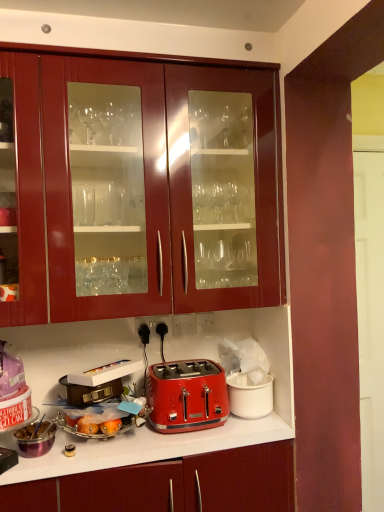
At what (x,y) coordinates should I click in order to perform the action: click on free space on the front side of red plastic toaster at center, acting as the 1th appliance starting from the right. Please return your answer as a coordinate pair (x, y). The image size is (384, 512). Looking at the image, I should click on (242, 431).